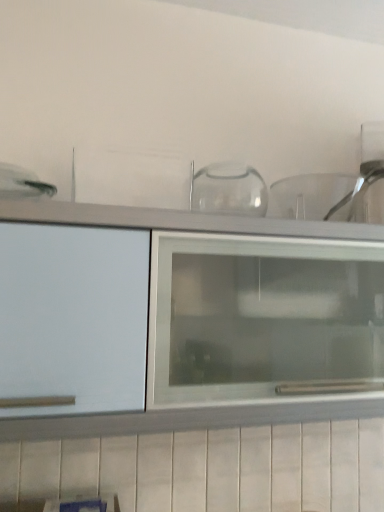
What do you see at coordinates (184, 320) in the screenshot? I see `white matte cabinet at upper center` at bounding box center [184, 320].

In order to face white matte cabinet at upper center, should I rotate leftwards or rightwards?

To face it directly, rotate right by 5.562 degrees.

Measure the distance between white matte cabinet at upper center and camera.

They are 34.07 inches apart.

At what (x,y) coordinates should I click in order to perform the action: click on white matte cabinet at upper center. Please return your answer as a coordinate pair (x, y). The image size is (384, 512). Looking at the image, I should click on (184, 320).

Image resolution: width=384 pixels, height=512 pixels. I want to click on white matte cabinet at upper center, so click(184, 320).